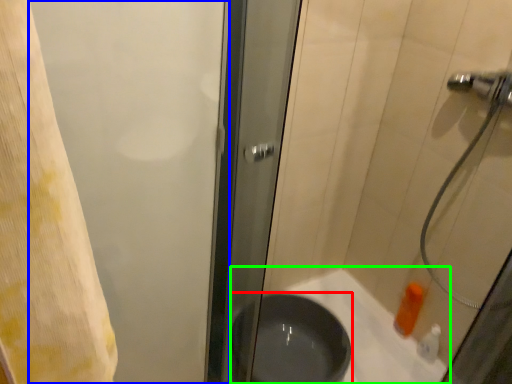
Question: Considering the real-world distances, which object is farthest from basin (highlighted by a red box)? screen door (highlighted by a blue box) or bath (highlighted by a green box)?

Choices:
 (A) screen door
 (B) bath

Answer: (A)